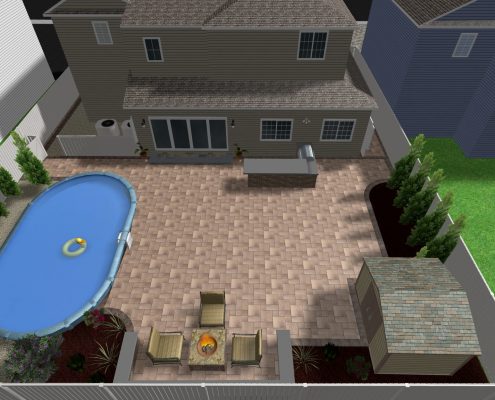
Identify the location of chairs. (214, 319), (171, 344), (251, 352).